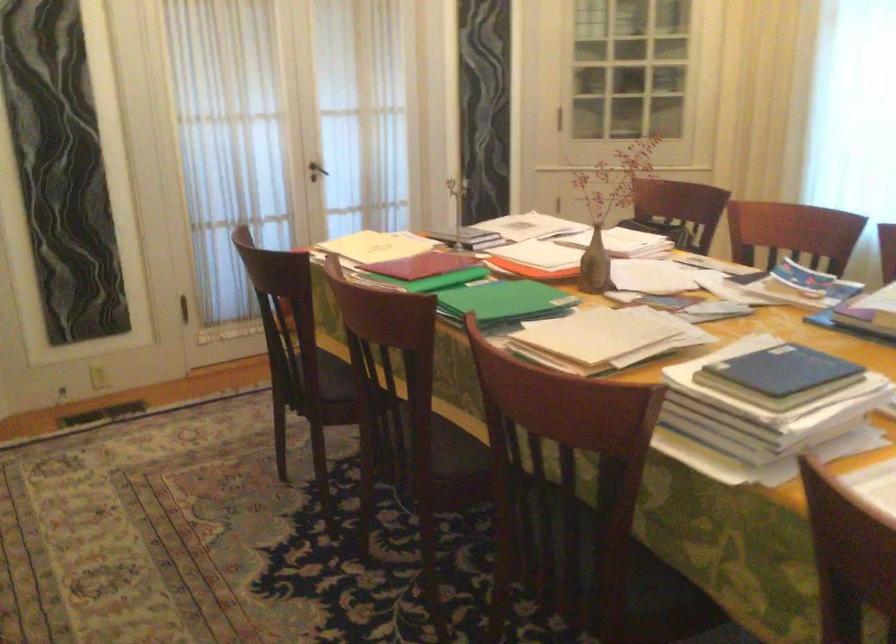
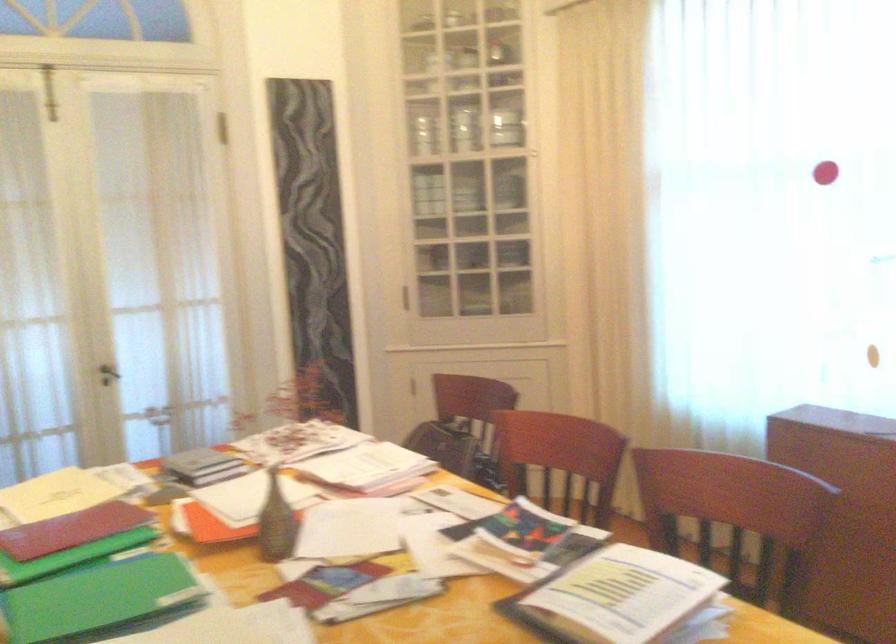
In a continuous first-person perspective shot, in which direction is the camera moving?

The cameraman walked toward right, forward.